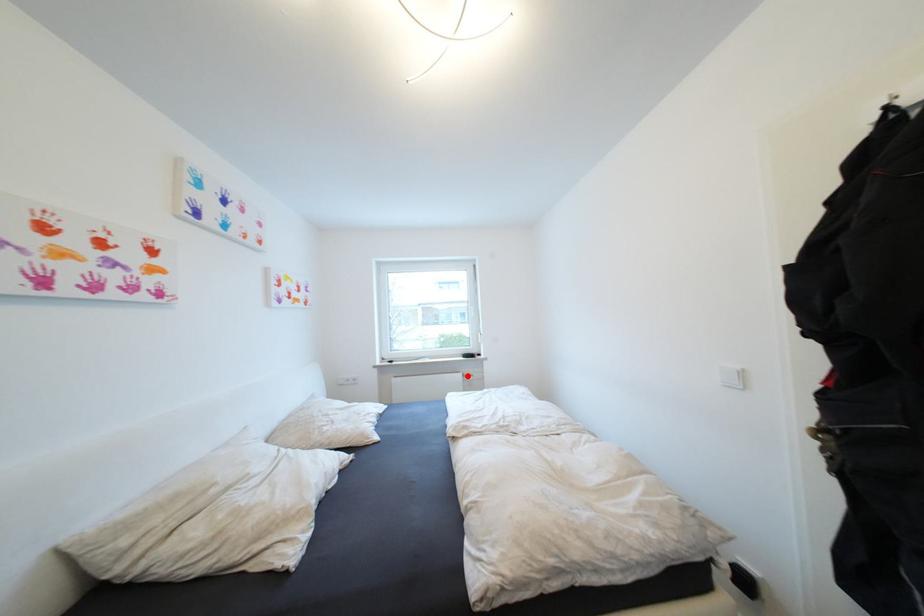
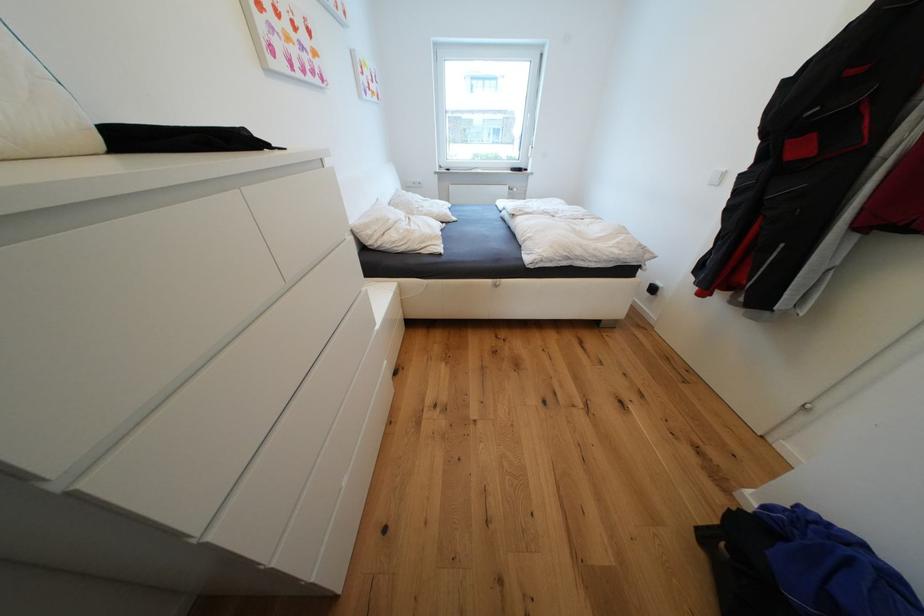
In the second image, find the point that corresponds to the highlighted location in the first image.

(515, 188)